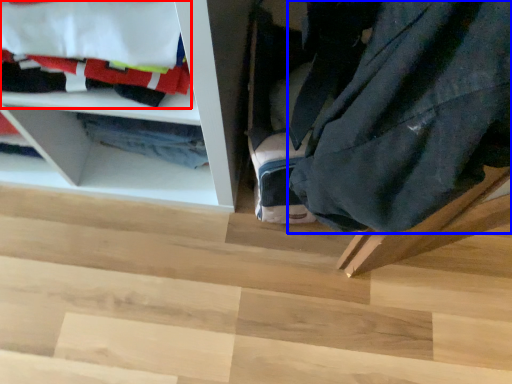
Question: Which of the following is the closest to the observer, laundry (highlighted by a red box) or clothing (highlighted by a blue box)?

Choices:
 (A) laundry
 (B) clothing

Answer: (B)